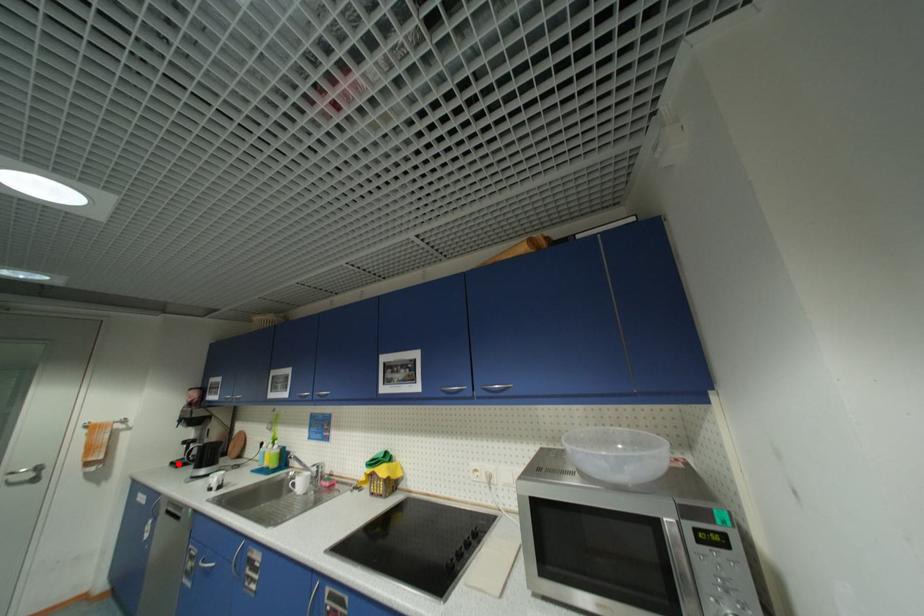
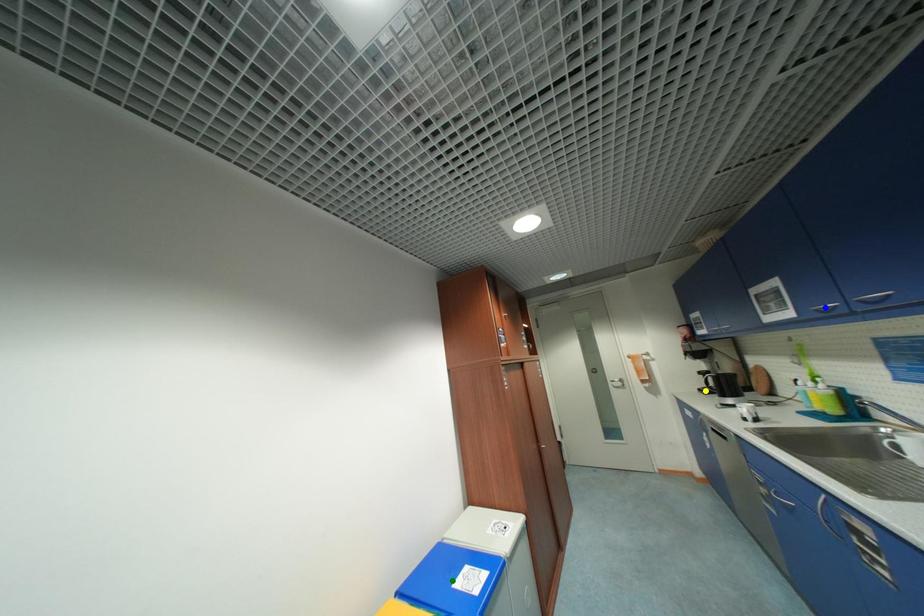
Question: I am providing you with two images of the same scene from different viewpoints. A red point is marked on the first image. You are given multiple points on the second image. Can you choose the point in image 2 that corresponds to the point in image 1?

Choices:
 (A) yellow point
 (B) green point
 (C) blue point

Answer: (A)